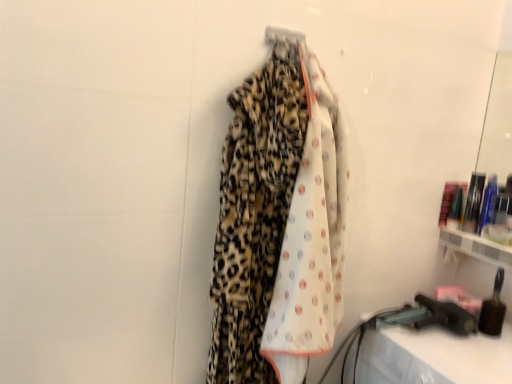
Question: Is metallic silver hanger at upper center further to camera compared to leopard print fabric at center?

Choices:
 (A) yes
 (B) no

Answer: (A)

Question: Is there a large distance between metallic silver hanger at upper center and leopard print fabric at center?

Choices:
 (A) no
 (B) yes

Answer: (A)

Question: Is metallic silver hanger at upper center closer to the viewer compared to leopard print fabric at center?

Choices:
 (A) no
 (B) yes

Answer: (A)

Question: Can you confirm if metallic silver hanger at upper center is thinner than leopard print fabric at center?

Choices:
 (A) no
 (B) yes

Answer: (B)

Question: Can you confirm if metallic silver hanger at upper center is shorter than leopard print fabric at center?

Choices:
 (A) yes
 (B) no

Answer: (A)

Question: From a real-world perspective, is leopard print fabric at center above or below brown bristle brush at lower right, acting as the 1th toiletry starting from the bottom?

Choices:
 (A) below
 (B) above

Answer: (B)

Question: Considering the relative positions of leopard print fabric at center and brown bristle brush at lower right, acting as the 1th toiletry starting from the bottom, in the image provided, is leopard print fabric at center to the left or to the right of brown bristle brush at lower right, acting as the 1th toiletry starting from the bottom,?

Choices:
 (A) right
 (B) left

Answer: (B)

Question: Is point (284, 276) closer or farther from the camera than point (502, 269)?

Choices:
 (A) closer
 (B) farther

Answer: (A)

Question: Based on their sizes in the image, would you say leopard print fabric at center is bigger or smaller than brown bristle brush at lower right, acting as the 1th toiletry starting from the bottom?

Choices:
 (A) small
 (B) big

Answer: (B)

Question: Looking at the image, does leopard print fabric at center seem bigger or smaller compared to metallic silver hanger at upper center?

Choices:
 (A) big
 (B) small

Answer: (A)

Question: Would you say leopard print fabric at center is inside or outside metallic silver hanger at upper center?

Choices:
 (A) inside
 (B) outside

Answer: (B)

Question: In terms of height, does leopard print fabric at center look taller or shorter compared to metallic silver hanger at upper center?

Choices:
 (A) tall
 (B) short

Answer: (A)

Question: In the image, is leopard print fabric at center on the left side or the right side of metallic silver hanger at upper center?

Choices:
 (A) right
 (B) left

Answer: (B)

Question: Looking at the image, does metallic silver hanger at upper center seem bigger or smaller compared to translucent plastic bottles at right, the 1th toiletry viewed from the back?

Choices:
 (A) small
 (B) big

Answer: (A)

Question: Considering the relative positions of metallic silver hanger at upper center and translucent plastic bottles at right, the first toiletry from the top, in the image provided, is metallic silver hanger at upper center to the left or to the right of translucent plastic bottles at right, the first toiletry from the top,?

Choices:
 (A) left
 (B) right

Answer: (A)